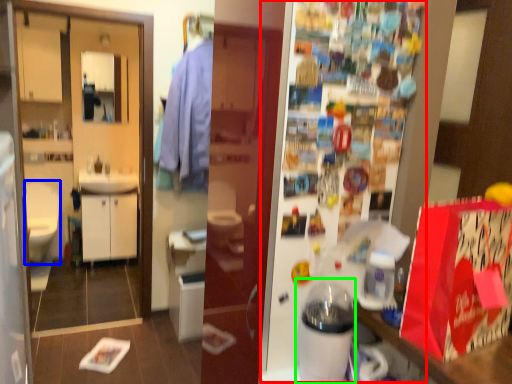
Question: Which object is the farthest from fridge (highlighted by a red box)? Choose among these: sit (highlighted by a blue box) or appliance (highlighted by a green box).

Choices:
 (A) sit
 (B) appliance

Answer: (A)